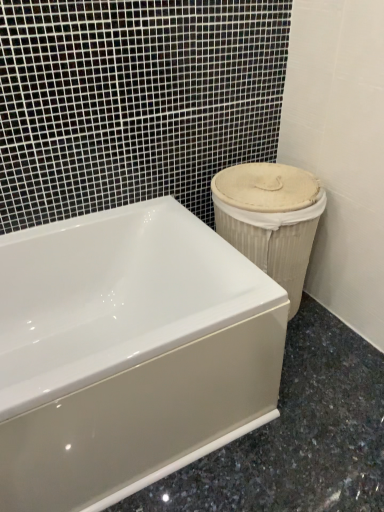
Question: Is beige woven basket at right wider than white glossy bathtub at center?

Choices:
 (A) no
 (B) yes

Answer: (A)

Question: Is beige woven basket at right at the right side of white glossy bathtub at center?

Choices:
 (A) yes
 (B) no

Answer: (A)

Question: Is white glossy bathtub at center at the back of beige woven basket at right?

Choices:
 (A) yes
 (B) no

Answer: (B)

Question: Considering the relative sizes of beige woven basket at right and white glossy bathtub at center in the image provided, is beige woven basket at right thinner than white glossy bathtub at center?

Choices:
 (A) yes
 (B) no

Answer: (A)

Question: Does beige woven basket at right have a larger size compared to white glossy bathtub at center?

Choices:
 (A) no
 (B) yes

Answer: (A)

Question: From the image's perspective, is beige woven basket at right beneath white glossy bathtub at center?

Choices:
 (A) no
 (B) yes

Answer: (A)

Question: From a real-world perspective, is white glossy bathtub at center on top of beige woven basket at right?

Choices:
 (A) no
 (B) yes

Answer: (A)

Question: Are white glossy bathtub at center and beige woven basket at right located far from each other?

Choices:
 (A) yes
 (B) no

Answer: (B)

Question: Is white glossy bathtub at center oriented away from beige woven basket at right?

Choices:
 (A) yes
 (B) no

Answer: (B)

Question: Can you confirm if white glossy bathtub at center is taller than beige woven basket at right?

Choices:
 (A) yes
 (B) no

Answer: (B)

Question: Can you confirm if white glossy bathtub at center is positioned to the left of beige woven basket at right?

Choices:
 (A) yes
 (B) no

Answer: (A)

Question: Is white glossy bathtub at center next to beige woven basket at right?

Choices:
 (A) yes
 (B) no

Answer: (B)

Question: In terms of height, does white glossy bathtub at center look taller or shorter compared to beige woven basket at right?

Choices:
 (A) short
 (B) tall

Answer: (A)